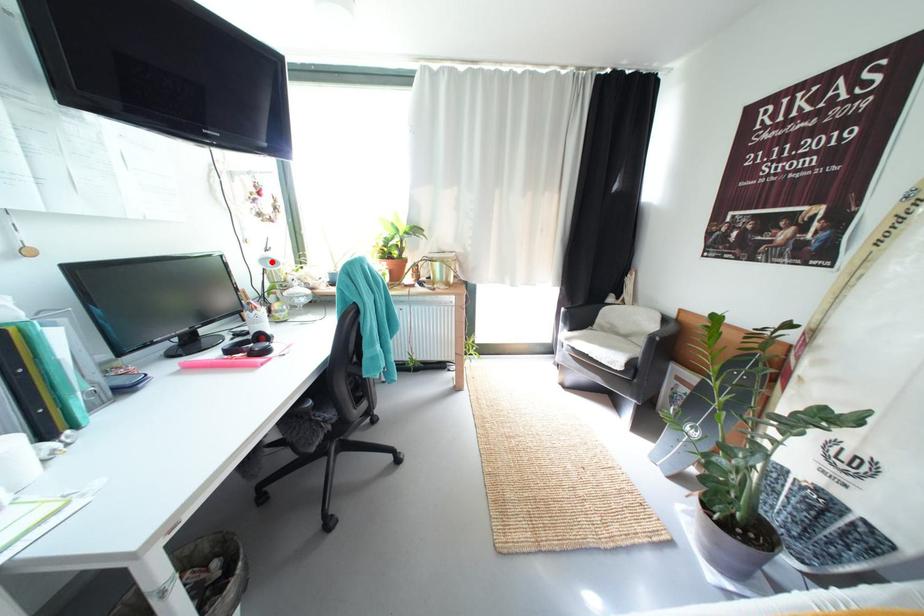
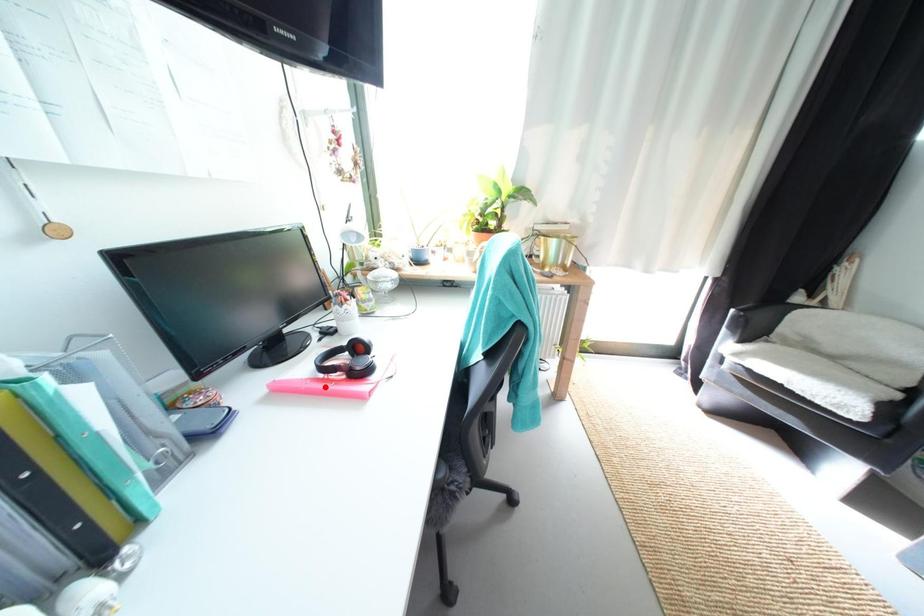
Consider the image. I am providing you with two images of the same scene from different viewpoints. A red point is marked on the first image and another point is marked on the second image. Are the points marked in image1 and image2 representing the same 3D position?

No